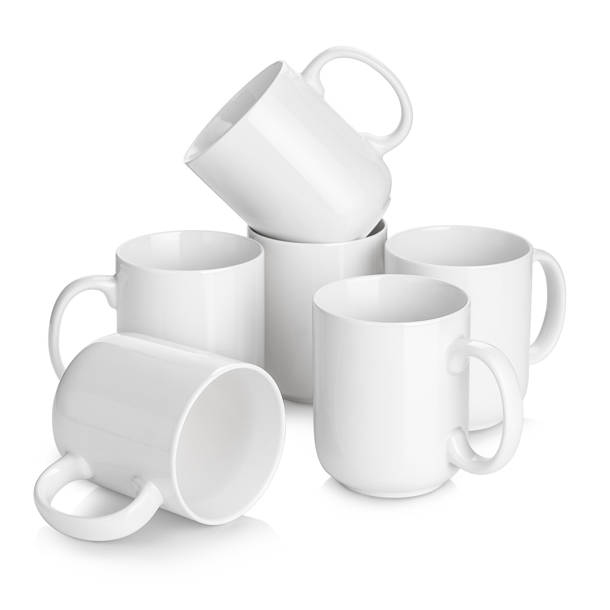
I want to click on handles, so click(x=124, y=518), click(x=106, y=279), click(x=490, y=465), click(x=558, y=293), click(x=389, y=142).